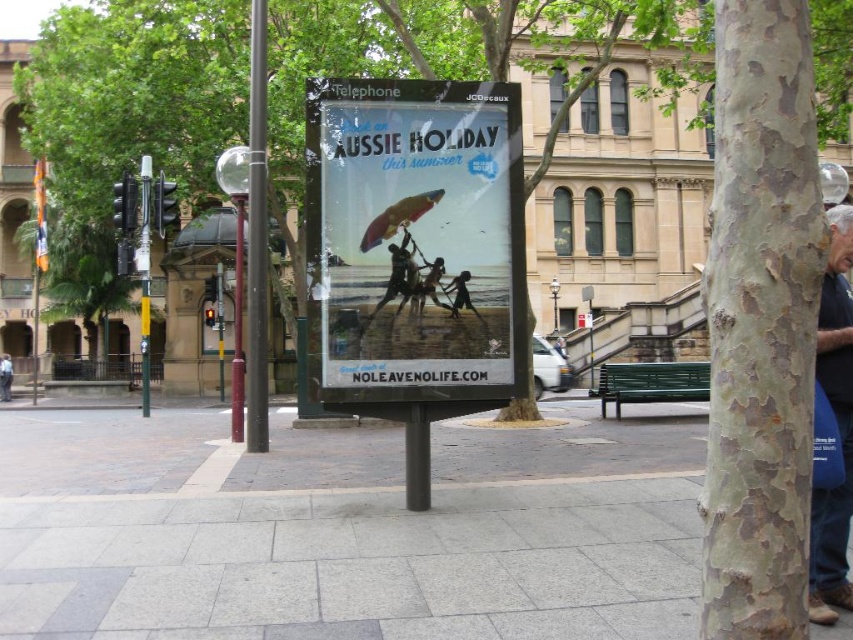
You are a delivery person who needs to place a 45 cm long package between the matte plastic poster at center and the matte black surfboard at center. Can you fit it without moving either object?

The matte plastic poster at center and the matte black surfboard at center are 46.08 centimeters apart. Since the package is 45 cm long, it can fit between them as the space is slightly larger than the package.

You are a delivery person who needs to hang a new 1.5 meter tall advertisement poster. You see the matte plastic poster at center and the matte black surfboard at center. Which object is taller and can accommodate your new poster?

The matte plastic poster at center is much taller than the matte black surfboard at center, so the matte plastic poster at center can accommodate the new 1.5 meter tall advertisement poster.

You are a photographer standing in front of the billboard advertisement. You want to take a photo that includes both the smooth bark tree at center and the green leafy tree at left. Which tree should you position closer to the camera to ensure both are in focus?

The smooth bark tree at center is closer to the viewer than the green leafy tree at left. To ensure both are in focus, position the camera closer to the smooth bark tree at center so the depth of field can cover both trees.